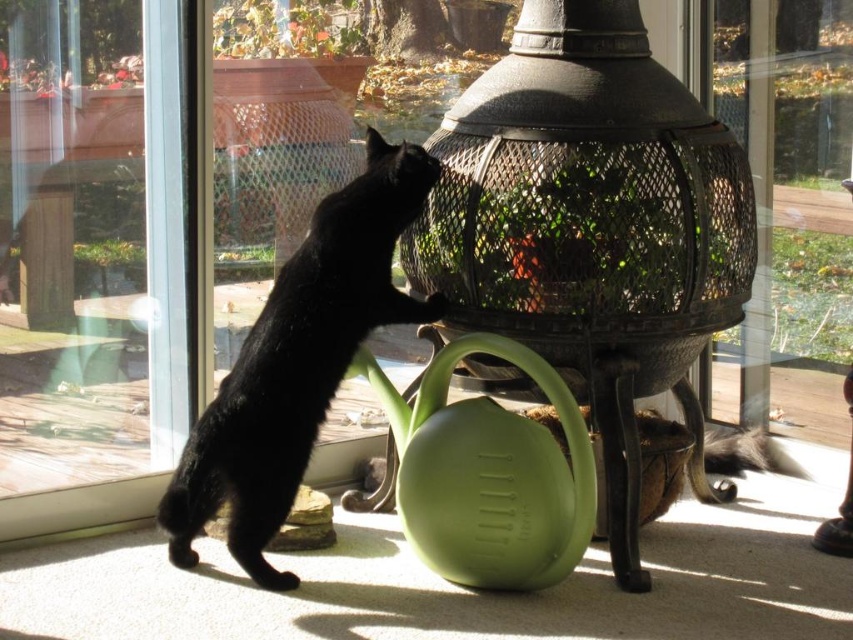
You are a pet owner who wants to place a small plant in the metallic wire birdcage at center. However, you notice the black glossy fur cat at left is nearby. Based on their positions, is the birdcage to the cat s left or right?

The metallic wire birdcage at center is positioned on the right side of the black glossy fur cat at left, so from the cat s perspective, the birdcage is to its right.

You are a small pet that wants to go through the transparent glass screen door at left but there is a metallic wire birdcage at center in the way. Can you go around it to reach the door?

The metallic wire birdcage at center is below the transparent glass screen door at left, so the birdcage is positioned lower and might not block the path. The pet can likely go around it to reach the door.